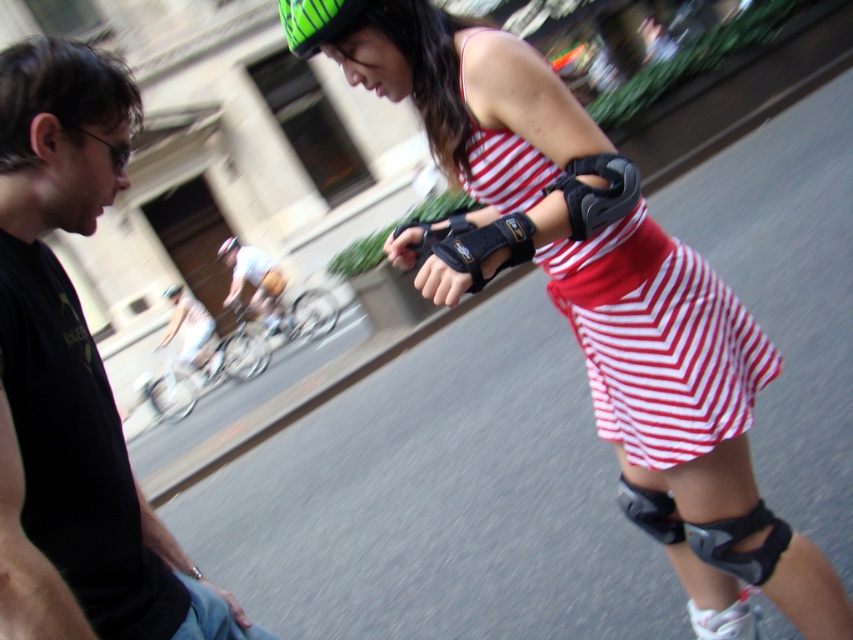
Question: Is black matte knee pad at lower center wider than green matte helmet at upper center?

Choices:
 (A) no
 (B) yes

Answer: (A)

Question: Which point is farther from the camera taking this photo?

Choices:
 (A) (689, 616)
 (B) (218, 253)
 (C) (309, 45)

Answer: (B)

Question: Is black mesh knee pad at lower right thinner than green striped helmet at upper center?

Choices:
 (A) yes
 (B) no

Answer: (A)

Question: Is matte black elbow pads at center to the right of black mesh knee pad at lower right from the viewer's perspective?

Choices:
 (A) yes
 (B) no

Answer: (B)

Question: Which object appears farthest from the camera in this image?

Choices:
 (A) matte black elbow pads at center
 (B) green matte helmet at upper center
 (C) black matte t-shirt at left

Answer: (B)

Question: Which point is farther to the camera?

Choices:
 (A) (91, 358)
 (B) (726, 625)
 (C) (508, 244)

Answer: (B)